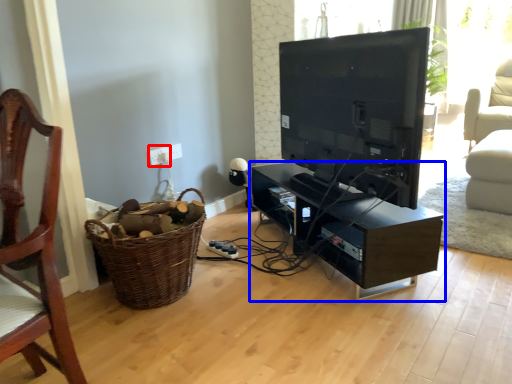
Question: Which object is further to the camera taking this photo, electric outlet (highlighted by a red box) or shelf (highlighted by a blue box)?

Choices:
 (A) electric outlet
 (B) shelf

Answer: (A)